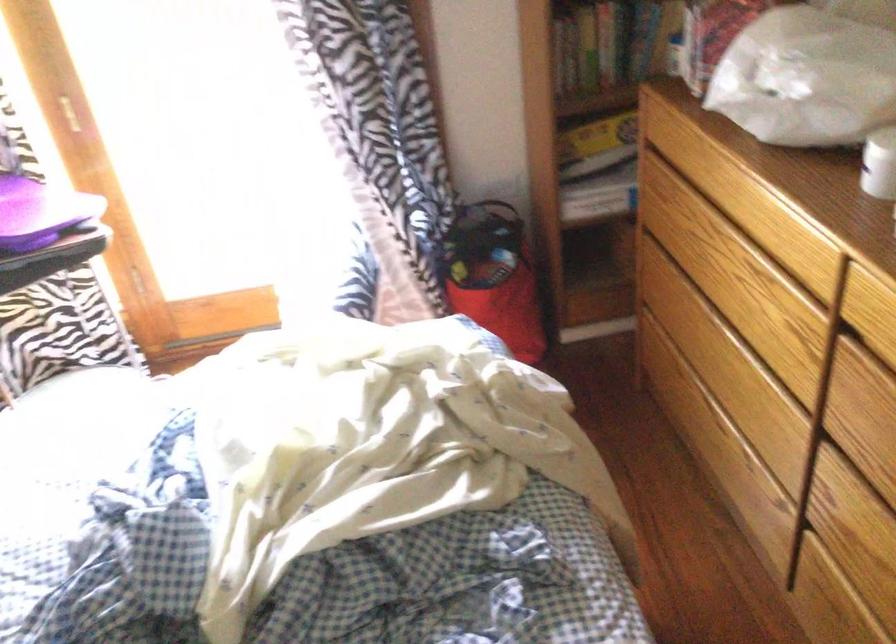
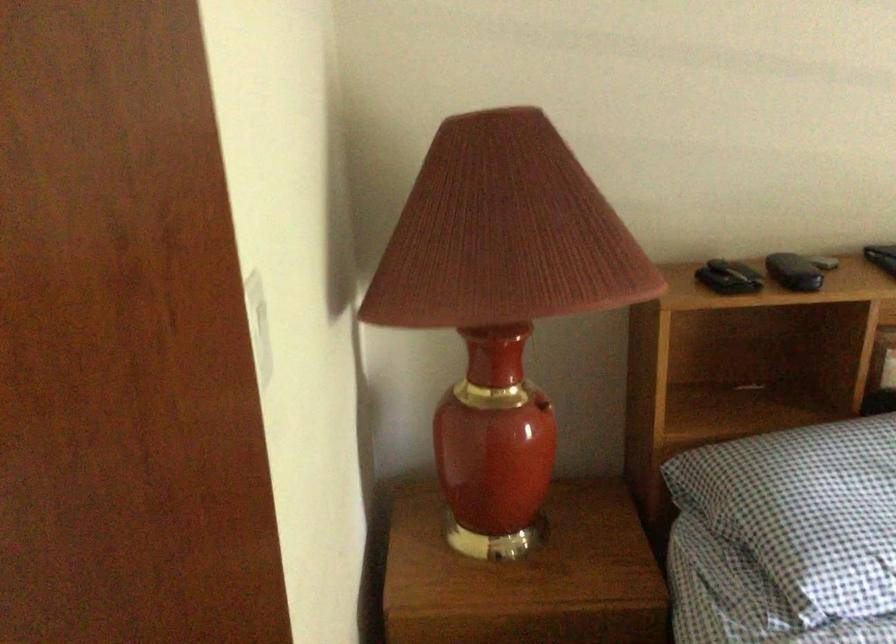
How did the camera likely rotate?

The camera's rotation is toward left-down.